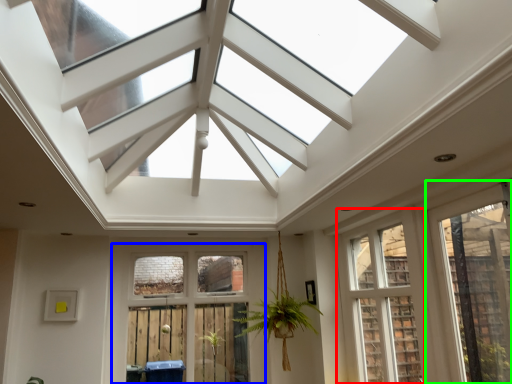
Question: Based on their relative distances, which object is nearer to window (highlighted by a red box)? Choose from window (highlighted by a blue box) and window (highlighted by a green box).

Choices:
 (A) window
 (B) window

Answer: (B)